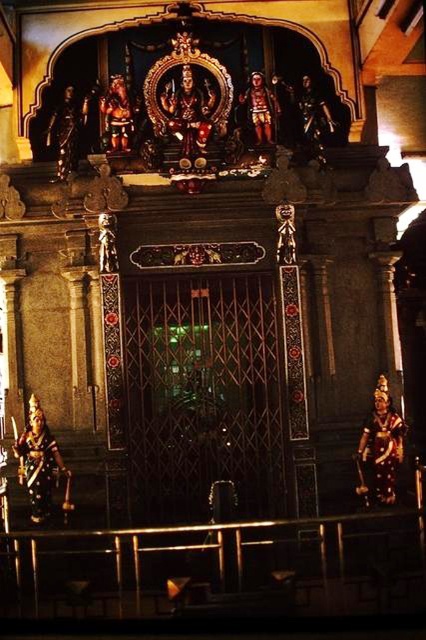
Based on the photo, you are an architect designing a new temple and want to replicate the spacing between the two polished bronze statues in the image. What is the exact distance between the polished bronze statue at lower right and the polished bronze statue at lower left?

The exact distance between the polished bronze statue at lower right and the polished bronze statue at lower left is 23.41 meters.

You are standing in the temple and want to touch the polished bronze statue at lower right. Can you reach it without moving closer?

The polished bronze statue at lower right is 238.16 feet away from the viewer, so you cannot reach it without moving closer.